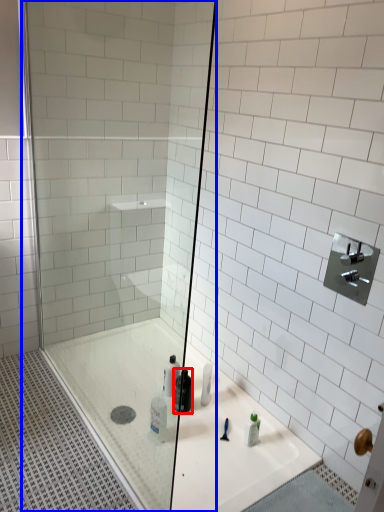
Question: Which of the following is the farthest to the observer, mouthwash (highlighted by a red box) or shower door (highlighted by a blue box)?

Choices:
 (A) mouthwash
 (B) shower door

Answer: (A)